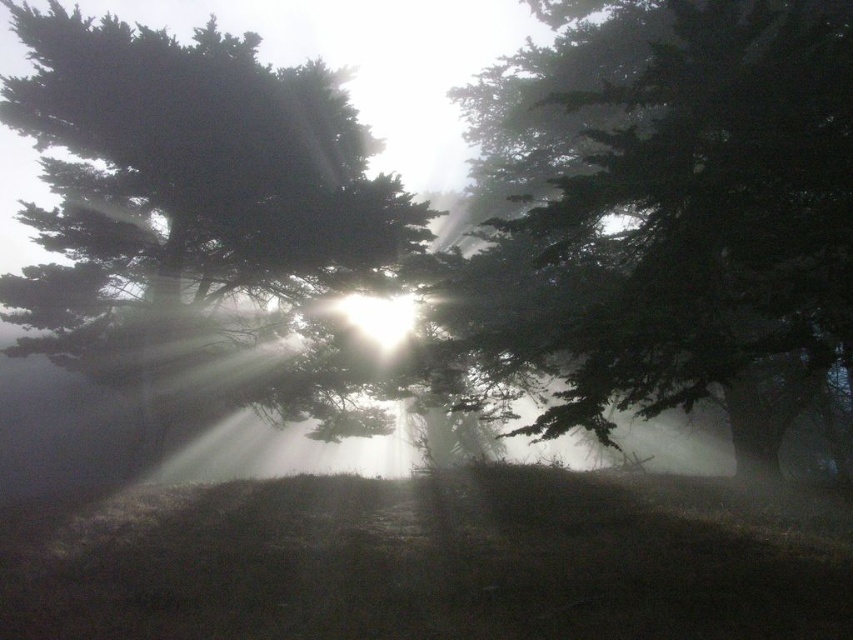
You are an artist trying to paint the forest scene. You notice the green matte tree at center and the green matte tree at upper left. Which tree should you draw narrower in your painting?

The green matte tree at center should be drawn narrower because its width is less than the green matte tree at upper left.

You are standing in the forest scene described. There is a green matte tree at upper left represented by point (x=192, y=172). Can you see the sun through the branches of the green matte tree at upper left?

The green matte tree at upper left is represented by point (x=192, y=172), so yes, the sun is positioned in the low sky, and its rays are streaming through the branches, which suggests that the sun is visible through the branches of the green matte tree at upper left.

You are standing in the forest and see the green matte tree at center and the green matte tree at upper left. Which tree is closer to you?

The green matte tree at center is closer to you because it is in front of the green matte tree at upper left.